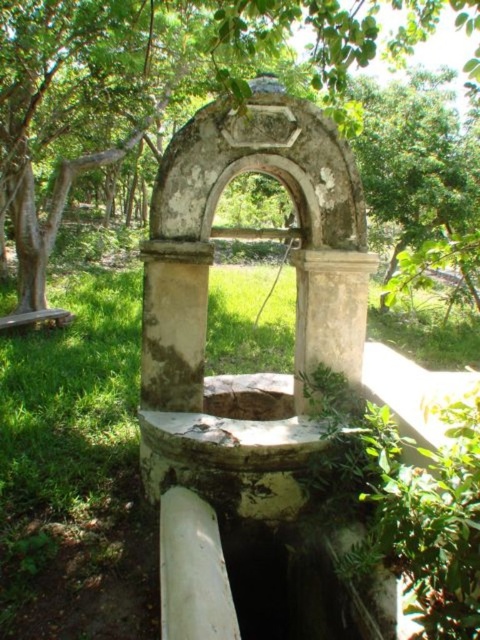
Does green grass at center have a larger size compared to green leafy tree at center?

Actually, green grass at center might be smaller than green leafy tree at center.

Between green grass at center and green leafy tree at center, which one has less height?

Standing shorter between the two is green grass at center.

The height and width of the screenshot is (640, 480). In order to click on green grass at center in this screenshot , I will do `click(75, 472)`.